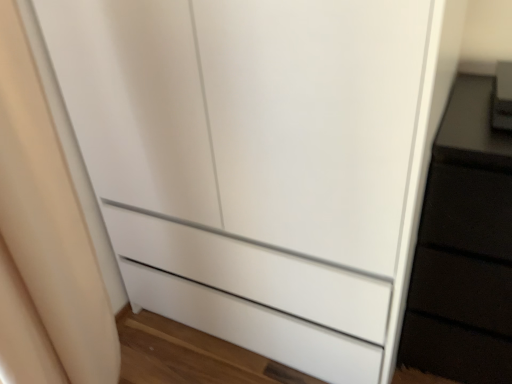
Question: From a real-world perspective, is satin black phone at upper right positioned under beige fabric curtain at left based on gravity?

Choices:
 (A) yes
 (B) no

Answer: (B)

Question: From the image's perspective, does satin black phone at upper right appear lower than beige fabric curtain at left?

Choices:
 (A) yes
 (B) no

Answer: (B)

Question: Considering the relative sizes of satin black phone at upper right and beige fabric curtain at left in the image provided, is satin black phone at upper right bigger than beige fabric curtain at left?

Choices:
 (A) no
 (B) yes

Answer: (A)

Question: Does satin black phone at upper right contain beige fabric curtain at left?

Choices:
 (A) no
 (B) yes

Answer: (A)

Question: Is satin black phone at upper right positioned behind beige fabric curtain at left?

Choices:
 (A) yes
 (B) no

Answer: (A)

Question: Is satin black phone at upper right closer to camera compared to beige fabric curtain at left?

Choices:
 (A) yes
 (B) no

Answer: (B)

Question: Would you say satin black phone at upper right is part of beige fabric curtain at left's contents?

Choices:
 (A) no
 (B) yes

Answer: (A)

Question: From a real-world perspective, is beige fabric curtain at left on satin black phone at upper right?

Choices:
 (A) no
 (B) yes

Answer: (A)

Question: Is beige fabric curtain at left in contact with satin black phone at upper right?

Choices:
 (A) no
 (B) yes

Answer: (A)

Question: Is beige fabric curtain at left further to the viewer compared to satin black phone at upper right?

Choices:
 (A) no
 (B) yes

Answer: (A)

Question: Is beige fabric curtain at left outside of satin black phone at upper right?

Choices:
 (A) no
 (B) yes

Answer: (B)

Question: From a real-world perspective, is beige fabric curtain at left positioned under satin black phone at upper right based on gravity?

Choices:
 (A) no
 (B) yes

Answer: (B)

Question: Based on their sizes in the image, would you say beige fabric curtain at left is bigger or smaller than satin black phone at upper right?

Choices:
 (A) small
 (B) big

Answer: (B)